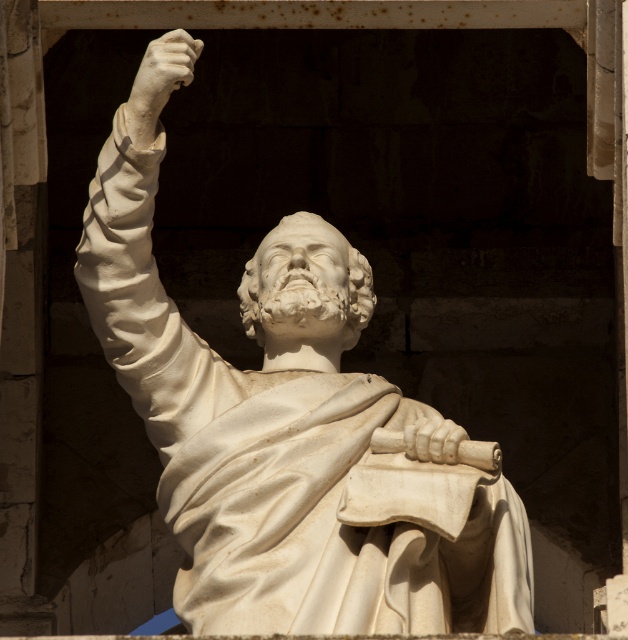
You are an art conservator examining the marble statue in the niche. You notice two points on the statue marked at coordinates point [112,228] and point [185,58]. Which of these points is closer to you as you stand in front of the statue?

Point [112,228] is closer to you than point [185,58] because it is further to the viewer according to the description.

You are an art conservator examining the statue in the image. You notice there is a white marble hand at upper left near the white marble statue at center. Could the hand be part of the statue itself or is it a separate object?

The white marble statue at center is positioned under white marble hand at upper left, indicating that the hand is a separate object above the statue, not part of it.

You are an art conservator assessing the space needed to transport the white marble statue at center and the white marble hand at upper left. Which object requires more horizontal space for storage?

The white marble statue at center requires more horizontal space for storage since its width surpasses that of the white marble hand at upper left.